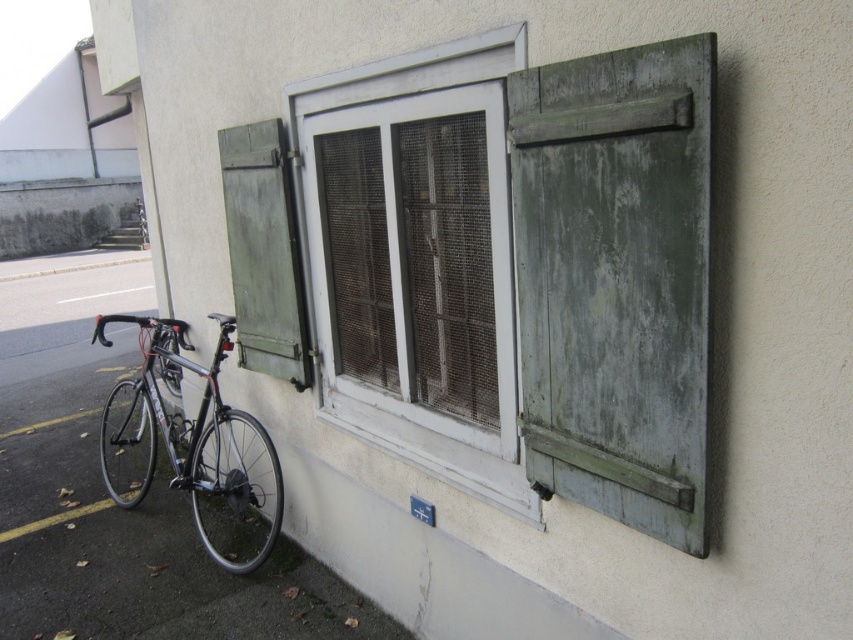
Question: Which point is closer to the camera?

Choices:
 (A) green weathered wood shutter at right
 (B) green weathered wood shutter at left
 (C) shiny metallic bicycle at left

Answer: (A)

Question: From the image, what is the correct spatial relationship of green weathered wood shutter at right in relation to green painted wood window at center?

Choices:
 (A) right
 (B) left

Answer: (A)

Question: Which of the following is the farthest from the observer?

Choices:
 (A) (320, 256)
 (B) (671, 176)
 (C) (260, 356)

Answer: (C)

Question: Which is nearer to the shiny metallic bicycle at left?

Choices:
 (A) green weathered wood shutter at right
 (B) green painted wood window at center
 (C) green weathered wood shutter at left

Answer: (C)

Question: Is green painted wood window at center thinner than green weathered wood shutter at left?

Choices:
 (A) no
 (B) yes

Answer: (A)

Question: Does green weathered wood shutter at left have a smaller size compared to shiny metallic bicycle at left?

Choices:
 (A) no
 (B) yes

Answer: (B)